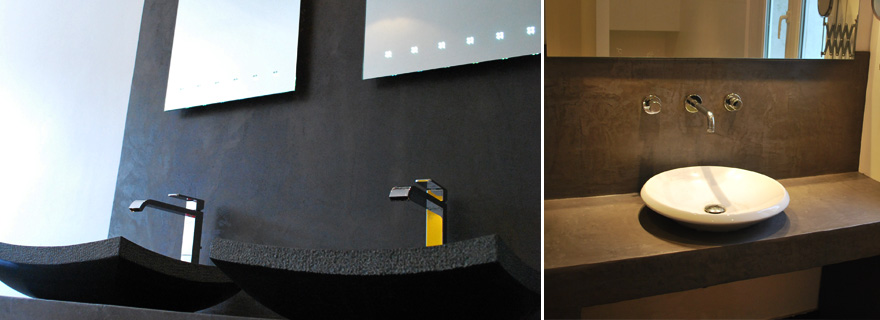
Identify the location of faucets. (188, 221), (440, 219), (700, 106).